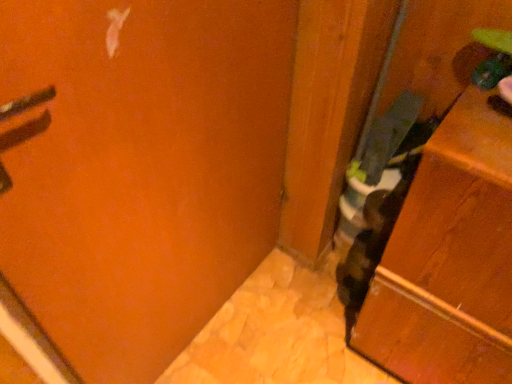
Describe the element at coordinates (449, 259) in the screenshot. I see `green matte cabinet at right` at that location.

This screenshot has width=512, height=384. What are the coordinates of `green matte cabinet at right` in the screenshot? It's located at (449, 259).

Locate an element on the screen. green matte cabinet at right is located at coordinates click(449, 259).